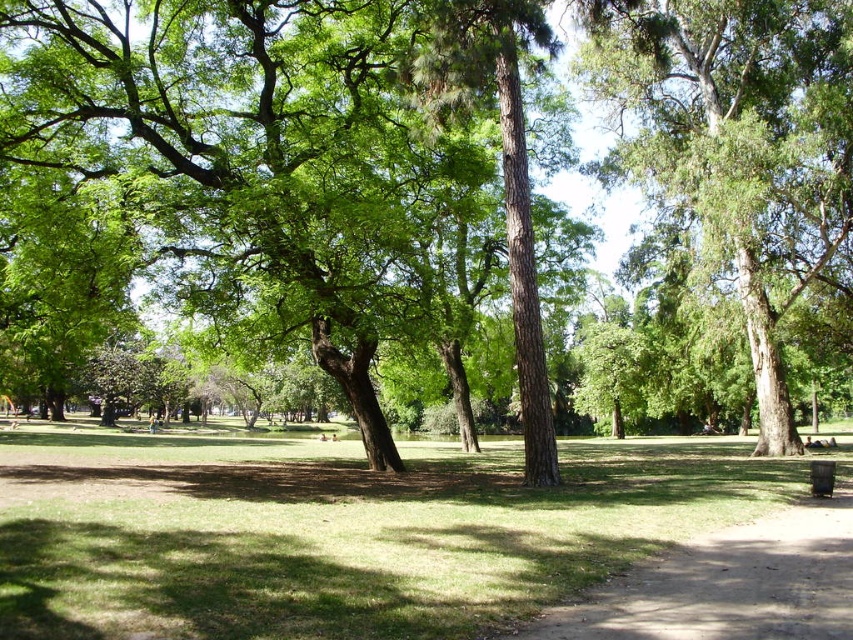
Between green grass at center and green leafy tree at center, which one has more height?

green leafy tree at center is taller.

Does point (325, 483) lie behind point (737, 3)?

No, it is not.

The image size is (853, 640). I want to click on green grass at center, so click(338, 531).

Measure the distance between point (751,144) and camera.

Point (751,144) is 26.07 meters away from camera.

The width and height of the screenshot is (853, 640). I want to click on green leafy tree at center, so click(x=740, y=145).

Between point (770, 125) and point (772, 545), which one is positioned behind?

The point (770, 125) is behind.

The height and width of the screenshot is (640, 853). What are the coordinates of `green leafy tree at center` in the screenshot? It's located at (740, 145).

Is point (279, 460) in front of point (824, 602)?

No, (279, 460) is further to viewer.

Is green grass at center below dirt path at lower right?

Indeed, green grass at center is positioned under dirt path at lower right.

Is point (639, 445) farther from viewer compared to point (753, 564)?

That is True.

You are a GUI agent. You are given a task and a screenshot of the screen. Output one action in this format:
    pyautogui.click(x=<x>, y=<y>)
    Task: Click on the green grass at center
    
    Given the screenshot: What is the action you would take?
    pyautogui.click(x=338, y=531)